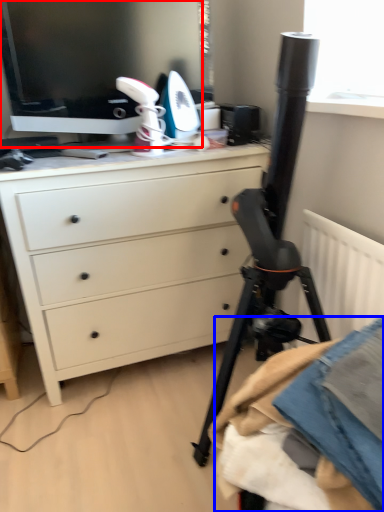
Question: Which object appears farthest to the camera in this image, computer monitor (highlighted by a red box) or clothing (highlighted by a blue box)?

Choices:
 (A) computer monitor
 (B) clothing

Answer: (A)